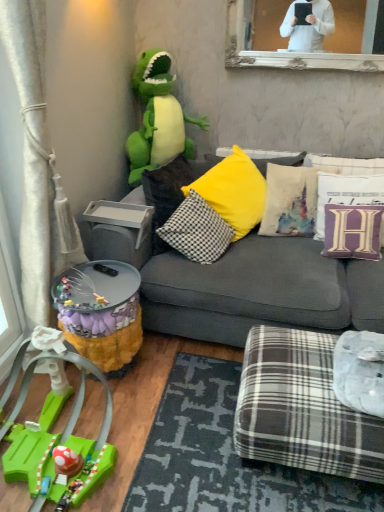
Identify the location of purple velvet pillow at upper right, the first pillow from the right. (346, 194).

Find the location of a particular element. This screenshot has height=512, width=384. plaid fabric ottoman at lower right is located at coordinates (302, 408).

Image resolution: width=384 pixels, height=512 pixels. Describe the element at coordinates (158, 118) in the screenshot. I see `green plush dinosaur at upper left, the 2th toy from the bottom` at that location.

Based on the photo, measure the distance between point (110, 468) and camera.

The depth of point (110, 468) is 1.61 meters.

Where is `dark gray textured mat at lower center`? dark gray textured mat at lower center is located at coordinates (224, 456).

Find the location of a particular element. textured white pillow at center right, which is the second pillow in left-to-right order is located at coordinates (290, 201).

From the image's perspective, is fuzzy yellow side table at lower left located beneath green plastic race track at lower left, the 1th toy positioned from the front?

No, from the image's perspective, fuzzy yellow side table at lower left is not beneath green plastic race track at lower left, the 1th toy positioned from the front.

Which object is thinner, fuzzy yellow side table at lower left or green plastic race track at lower left, acting as the second toy starting from the back?

Thinner between the two is fuzzy yellow side table at lower left.

Considering the sizes of objects fuzzy yellow side table at lower left and green plastic race track at lower left, acting as the second toy starting from the back, in the image provided, who is bigger, fuzzy yellow side table at lower left or green plastic race track at lower left, acting as the second toy starting from the back,?

green plastic race track at lower left, acting as the second toy starting from the back, is bigger.

From the picture: Is fuzzy yellow side table at lower left completely or partially outside of green plastic race track at lower left, acting as the second toy starting from the back?

That's correct, fuzzy yellow side table at lower left is outside of green plastic race track at lower left, acting as the second toy starting from the back.

Is purple velvet pillow at upper right, the first pillow from the right, directly adjacent to purple velvet pillow at upper right, which is the 3th pillow from left to right?

purple velvet pillow at upper right, the first pillow from the right, and purple velvet pillow at upper right, which is the 3th pillow from left to right, are not in contact.

Considering the sizes of objects purple velvet pillow at upper right, the first pillow from the right, and purple velvet pillow at upper right, which is the 3th pillow from left to right, in the image provided, who is taller, purple velvet pillow at upper right, the first pillow from the right, or purple velvet pillow at upper right, which is the 3th pillow from left to right,?

With more height is purple velvet pillow at upper right, the first pillow from the right.

Looking at this image, does purple velvet pillow at upper right, the first pillow from the right, have a greater width compared to purple velvet pillow at upper right, which is the 3th pillow from left to right?

Correct, the width of purple velvet pillow at upper right, the first pillow from the right, exceeds that of purple velvet pillow at upper right, which is the 3th pillow from left to right.

The height and width of the screenshot is (512, 384). Identify the location of the 1st pillow located beneath the purple velvet pillow at upper right, the first pillow from the right (from a real-world perspective). (352, 231).

Is purple velvet pillow at upper right, which is the 3th pillow from left to right, smaller than black-and-white checkered pillow at center, the 1th pillow from the left?

Correct, purple velvet pillow at upper right, which is the 3th pillow from left to right, occupies less space than black-and-white checkered pillow at center, the 1th pillow from the left.

Does purple velvet pillow at upper right, which is the 3th pillow from left to right, come behind black-and-white checkered pillow at center, the 1th pillow from the left?

Yes, purple velvet pillow at upper right, which is the 3th pillow from left to right, is further from the camera.

From the image's perspective, which object appears higher, purple velvet pillow at upper right, which appears as the second pillow when viewed from the right, or black-and-white checkered pillow at center, which is counted as the 4th pillow, starting from the right?

purple velvet pillow at upper right, which appears as the second pillow when viewed from the right, is shown above in the image.

Is purple velvet pillow at upper right, which appears as the second pillow when viewed from the right, oriented towards black-and-white checkered pillow at center, which is counted as the 4th pillow, starting from the right?

No, purple velvet pillow at upper right, which appears as the second pillow when viewed from the right, is not facing towards black-and-white checkered pillow at center, which is counted as the 4th pillow, starting from the right.

How many degrees apart are the facing directions of textured white pillow at center right, arranged as the third pillow when viewed from the right, and fuzzy yellow side table at lower left?

The facing directions of textured white pillow at center right, arranged as the third pillow when viewed from the right, and fuzzy yellow side table at lower left are 79.2 degrees apart.

Locate an element on the screen. side table that appears on the left of textured white pillow at center right, arranged as the third pillow when viewed from the right is located at coordinates (101, 312).

Does point (310, 178) appear closer or farther from the camera than point (83, 318)?

Point (310, 178).

From the image's perspective, is textured white pillow at center right, arranged as the third pillow when viewed from the right, over fuzzy yellow side table at lower left?

Yes, from the image's perspective, textured white pillow at center right, arranged as the third pillow when viewed from the right, is above fuzzy yellow side table at lower left.

Is gray plastic tray at lower left located outside green plastic race track at lower left, the second toy when ordered from top to bottom?

gray plastic tray at lower left lies outside green plastic race track at lower left, the second toy when ordered from top to bottom,'s area.

Between gray plastic tray at lower left and green plastic race track at lower left, the 1th toy positioned from the front, which one is positioned in front?

green plastic race track at lower left, the 1th toy positioned from the front, is closer to the camera.

Considering the sizes of objects gray plastic tray at lower left and green plastic race track at lower left, acting as the second toy starting from the back, in the image provided, who is smaller, gray plastic tray at lower left or green plastic race track at lower left, acting as the second toy starting from the back,?

gray plastic tray at lower left.

Considering the relative sizes of gray plastic tray at lower left and green plastic race track at lower left, the 1th toy positioned from the front, in the image provided, is gray plastic tray at lower left wider than green plastic race track at lower left, the 1th toy positioned from the front,?

Incorrect, the width of gray plastic tray at lower left does not surpass that of green plastic race track at lower left, the 1th toy positioned from the front.

Considering the sizes of objects purple velvet pillow at upper right, which is the 3th pillow from left to right, and dark gray textured mat at lower center in the image provided, who is smaller, purple velvet pillow at upper right, which is the 3th pillow from left to right, or dark gray textured mat at lower center?

Smaller between the two is purple velvet pillow at upper right, which is the 3th pillow from left to right.

In terms of height, does purple velvet pillow at upper right, which is the 3th pillow from left to right, look taller or shorter compared to dark gray textured mat at lower center?

In the image, purple velvet pillow at upper right, which is the 3th pillow from left to right, appears to be taller than dark gray textured mat at lower center.

The width and height of the screenshot is (384, 512). In order to click on the 2nd pillow positioned above the dark gray textured mat at lower center (from the image's perspective) in this screenshot , I will do `click(352, 231)`.

From a real-world perspective, between purple velvet pillow at upper right, which is the 3th pillow from left to right, and dark gray textured mat at lower center, who is vertically lower?

From a 3D spatial view, dark gray textured mat at lower center is below.

You are a GUI agent. You are given a task and a screenshot of the screen. Output one action in this format:
    pyautogui.click(x=<x>, y=<y>)
    Task: Click on the toy that appears behind the gray plastic tray at lower left
    Image resolution: width=384 pixels, height=512 pixels.
    Given the screenshot: What is the action you would take?
    pyautogui.click(x=158, y=118)

In the scene shown: Does gray plastic tray at lower left turn towards green plush dinosaur at upper left, the 2th toy from the bottom?

No, gray plastic tray at lower left is not oriented towards green plush dinosaur at upper left, the 2th toy from the bottom.

How much distance is there between gray plastic tray at lower left and green plush dinosaur at upper left, placed as the 1th toy when sorted from back to front?

24.44 inches.

Is gray plastic tray at lower left closer to the viewer compared to green plush dinosaur at upper left, the 2th toy from the bottom?

Yes, gray plastic tray at lower left is in front of green plush dinosaur at upper left, the 2th toy from the bottom.

The image size is (384, 512). What are the coordinates of `side table behind the green plastic race track at lower left, the second toy when ordered from top to bottom` in the screenshot? It's located at (101, 312).

Find the location of a particular element. pillow located on the right of purple velvet pillow at upper right, which appears as the second pillow when viewed from the right is located at coordinates [x=346, y=194].

When comparing their distances from gray plastic tray at lower left, does purple velvet pillow at upper right, which appears as the second pillow when viewed from the right, or black-and-white checkered pillow at center, the 1th pillow from the left, seem further?

purple velvet pillow at upper right, which appears as the second pillow when viewed from the right.

Which object lies nearer to the anchor point dark gray textured mat at lower center, textured white pillow at center right, arranged as the third pillow when viewed from the right, or plaid fabric ottoman at lower right?

Based on the image, plaid fabric ottoman at lower right appears to be nearer to dark gray textured mat at lower center.

Considering their positions, is green plush dinosaur at upper left, the 2th toy from the front, positioned closer to textured white pillow at center right, which is the second pillow in left-to-right order, than gray plastic tray at lower left?

green plush dinosaur at upper left, the 2th toy from the front, is positioned closer to the anchor textured white pillow at center right, which is the second pillow in left-to-right order.

When comparing their distances from gray fabric couch at center, does fuzzy yellow side table at lower left or green plastic race track at lower left, the 1th toy positioned from the front, seem closer?

fuzzy yellow side table at lower left is positioned closer to the anchor gray fabric couch at center.

From the image, which object appears to be nearer to purple velvet pillow at upper right, the first pillow from the right, dark gray textured mat at lower center or green plush dinosaur at upper left, the 2th toy from the front?

green plush dinosaur at upper left, the 2th toy from the front, is positioned closer to the anchor purple velvet pillow at upper right, the first pillow from the right.

From the image, which object appears to be nearer to plaid fabric ottoman at lower right, fuzzy yellow side table at lower left or gray fabric couch at center?

gray fabric couch at center lies closer to plaid fabric ottoman at lower right than the other object.

Which object lies nearer to the anchor point black-and-white checkered pillow at center, the 1th pillow from the left, dark gray textured mat at lower center or green plush dinosaur at upper left, positioned as the first toy in top-to-bottom order?

green plush dinosaur at upper left, positioned as the first toy in top-to-bottom order, lies closer to black-and-white checkered pillow at center, the 1th pillow from the left, than the other object.

Estimate the real-world distances between objects in this image. Which object is closer to dark gray textured mat at lower center, green plush dinosaur at upper left, the 2th toy from the front, or textured white pillow at center right, arranged as the third pillow when viewed from the right?

Among the two, textured white pillow at center right, arranged as the third pillow when viewed from the right, is located nearer to dark gray textured mat at lower center.

Identify the location of studio couch that lies between gray plastic tray at lower left and dark gray textured mat at lower center from top to bottom. (249, 287).

Identify the location of mat between green plastic race track at lower left, the second toy when ordered from top to bottom, and purple velvet pillow at upper right, which is the 3th pillow from left to right, from left to right. This screenshot has height=512, width=384. (224, 456).

What are the coordinates of `toy between black-and-white checkered pillow at center, the 1th pillow from the left, and dark gray textured mat at lower center vertically` in the screenshot? It's located at (57, 443).

Locate an element on the screen. studio couch between green plush dinosaur at upper left, the 2th toy from the front, and plaid fabric ottoman at lower right in the up-down direction is located at coordinates (249, 287).